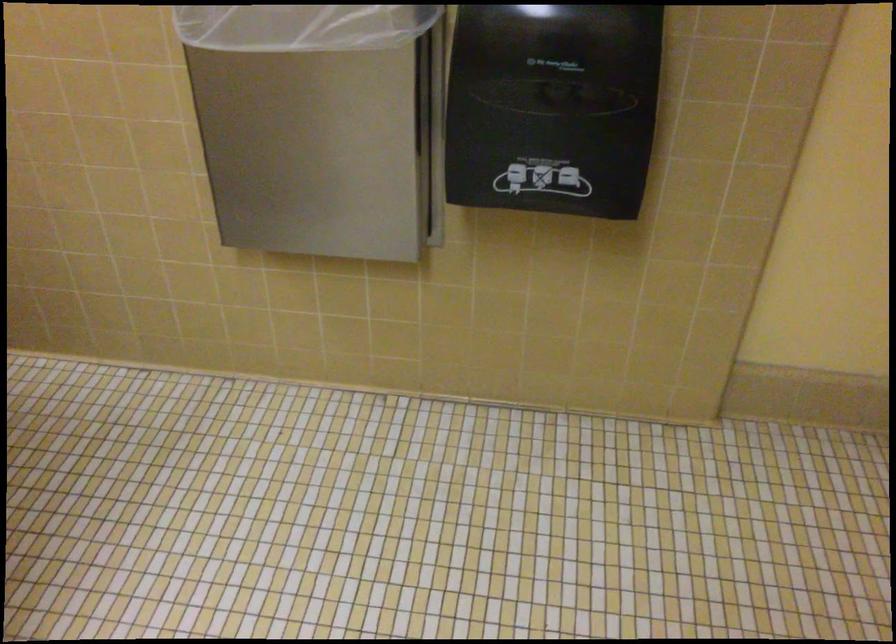
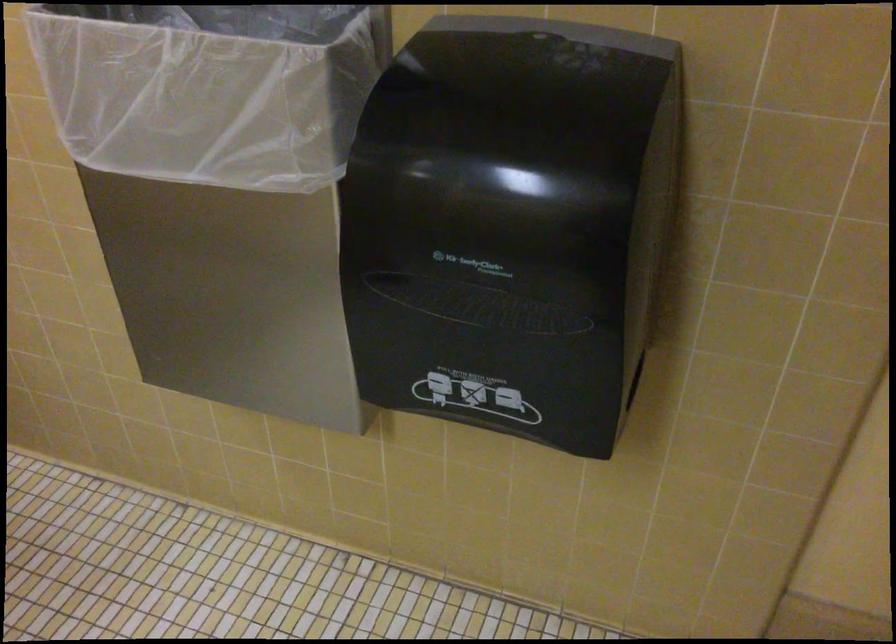
The images are taken continuously from a first-person perspective. In which direction are you moving?

The movement direction of the cameraman is right, forward.